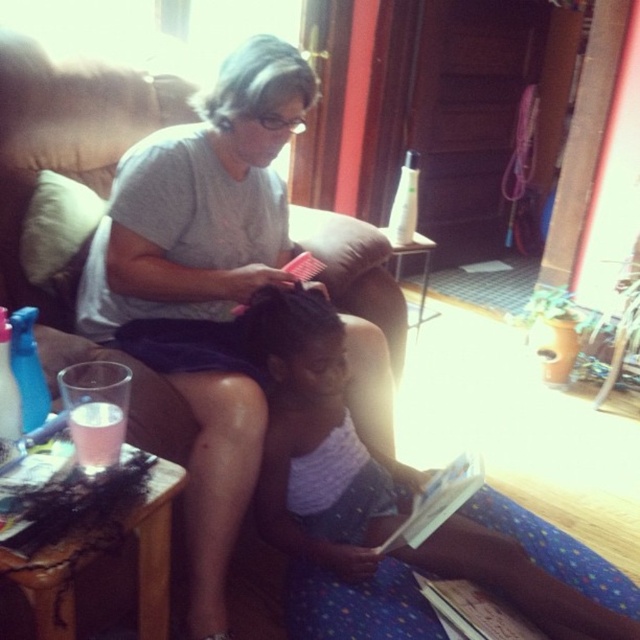
Can you confirm if matte gray shirt at center is wider than pink fabric dress at center?

Incorrect, matte gray shirt at center's width does not surpass pink fabric dress at center's.

Who is higher up, matte gray shirt at center or pink fabric dress at center?

Positioned higher is matte gray shirt at center.

Locate an element on the screen. matte gray shirt at center is located at coordinates (204, 284).

Locate an element on the screen. The width and height of the screenshot is (640, 640). matte gray shirt at center is located at coordinates (204, 284).

Does matte gray shirt at center have a lesser width compared to white fabric pillow at left?

No, matte gray shirt at center is not thinner than white fabric pillow at left.

Is matte gray shirt at center to the right of white fabric pillow at left from the viewer's perspective?

Answer: Correct, you'll find matte gray shirt at center to the right of white fabric pillow at left.

At what (x,y) coordinates should I click in order to perform the action: click on matte gray shirt at center. Please return your answer as a coordinate pair (x, y). Looking at the image, I should click on (204, 284).

Can you confirm if pink fabric dress at center is wider than white fabric pillow at left?

Yes, pink fabric dress at center is wider than white fabric pillow at left.

Looking at this image, is pink fabric dress at center behind white fabric pillow at left?

No, it is not.

Who is more distant from viewer, (509, 550) or (51, 188)?

Point (51, 188)

Find the location of a particular element. The height and width of the screenshot is (640, 640). pink fabric dress at center is located at coordinates (307, 440).